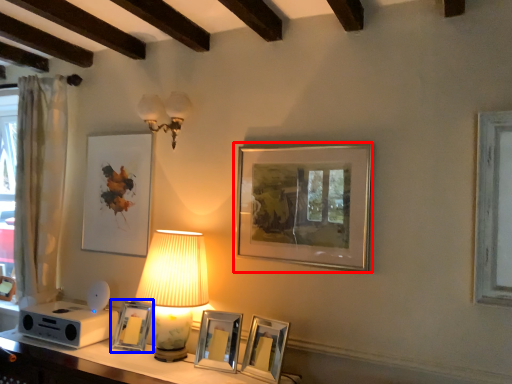
Question: Which of the following is the closest to the observer, picture frame (highlighted by a red box) or picture frame (highlighted by a blue box)?

Choices:
 (A) picture frame
 (B) picture frame

Answer: (A)